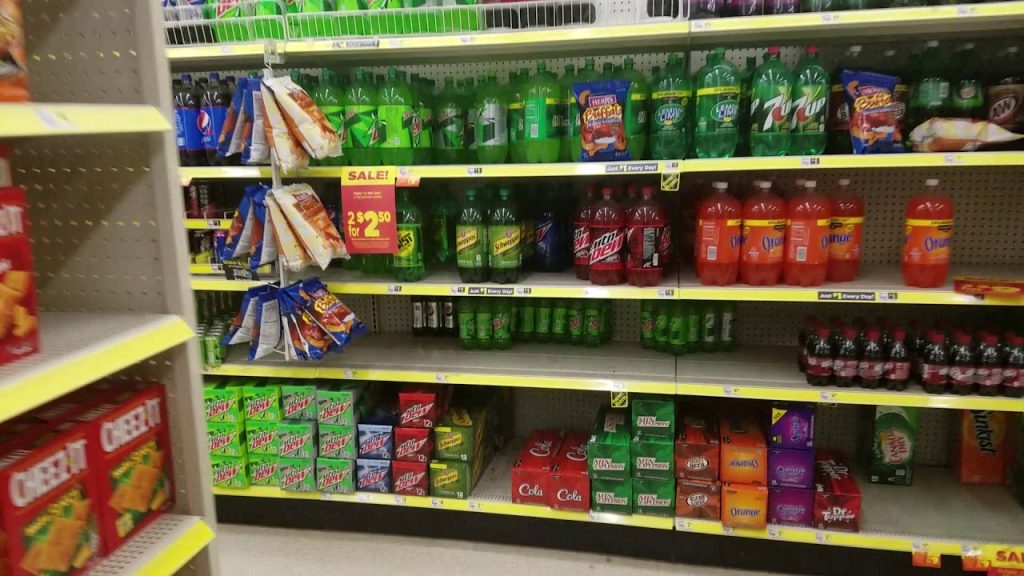
Locate an element on the screen. The height and width of the screenshot is (576, 1024). boxes of snacks is located at coordinates (147, 452), (60, 485), (19, 316), (9, 58), (84, 405), (23, 438).